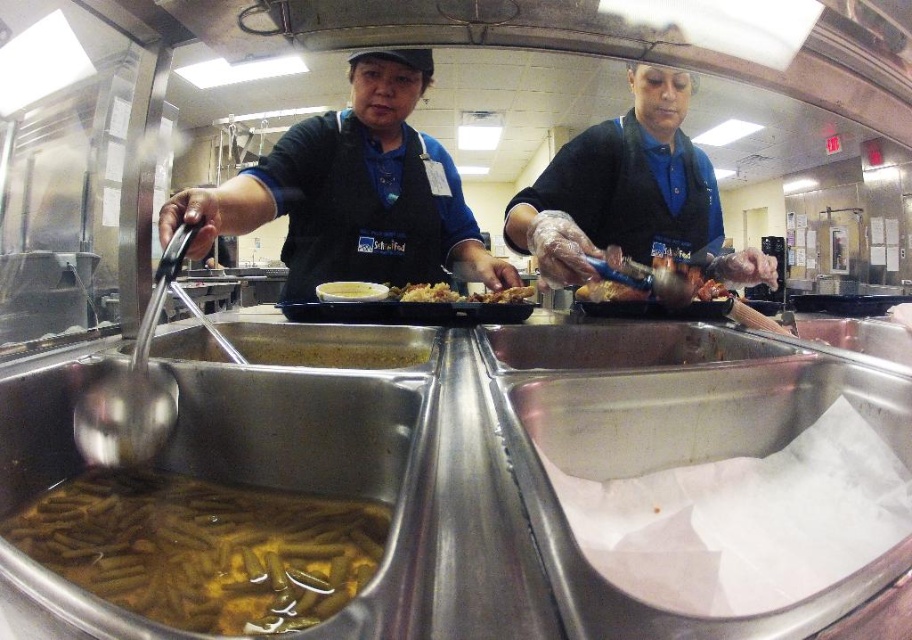
You are standing at the point labeled point at (431, 195). You want to reach the door located at the opposite end of the cafeteria. There is an obstacle 4.81 feet away from your current position. Can you navigate around it to reach the door?

The obstacle is 4.81 feet away from the point at (431, 195). Since the distance is known, you can plan a path around the obstacle to reach the door.

You are a customer trying to choose between the blue fabric apron at center and the brown matte rice at center. Since you want the wider item, which one should you pick?

The blue fabric apron at center is wider than the brown matte rice at center, so you should pick the blue fabric apron at center.

You are a customer at the cafeteria and want to choose between the brown matte rice at center and the brown crispy chicken at center. Based on their appearance, which dish is more likely to be the main course?

The brown crispy chicken at center is more likely to be the main course because it is thicker than the brown matte rice at center, which is thinner.